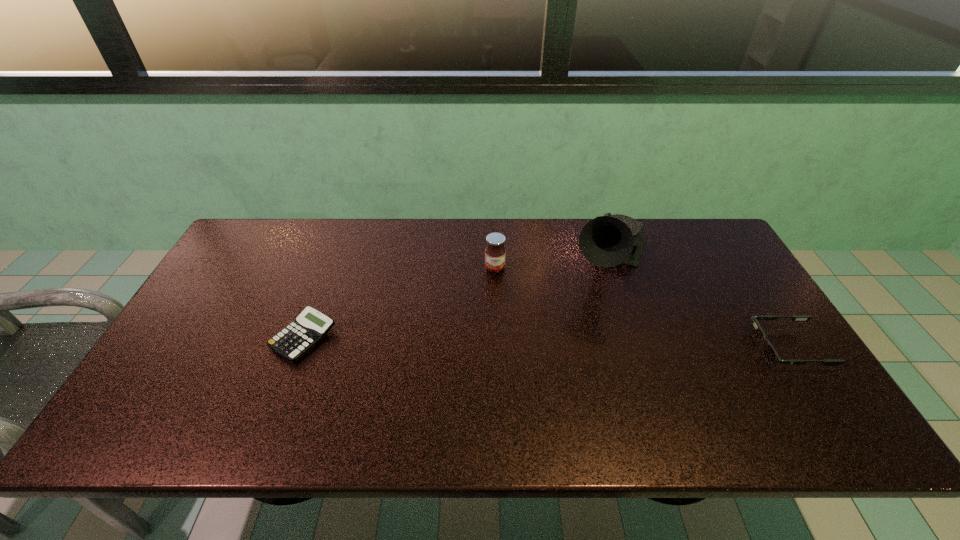
Where is `object located at the right edge`? object located at the right edge is located at coordinates (770, 355).

Locate an element on the screen. The height and width of the screenshot is (540, 960). vacant space at the far edge is located at coordinates (575, 219).

Identify the location of blank space at the near edge. This screenshot has width=960, height=540. (678, 384).

Locate an element on the screen. The height and width of the screenshot is (540, 960). vacant area at the left edge is located at coordinates (161, 373).

Image resolution: width=960 pixels, height=540 pixels. In order to click on vacant point at the far left corner in this screenshot , I will do pyautogui.click(x=256, y=224).

Image resolution: width=960 pixels, height=540 pixels. In order to click on free space at the far right corner of the desktop in this screenshot , I will do `click(708, 229)`.

Locate an element on the screen. Image resolution: width=960 pixels, height=540 pixels. unoccupied area between the sunglasses and the third object from right to left is located at coordinates (641, 308).

The height and width of the screenshot is (540, 960). I want to click on vacant point located between the second object from right to left and the jam, so point(553,264).

Identify the location of free spot between the sunglasses and the third object from left to right. The image size is (960, 540). (699, 304).

The image size is (960, 540). In order to click on free area in between the third shortest object and the shortest object in this screenshot , I will do `click(399, 302)`.